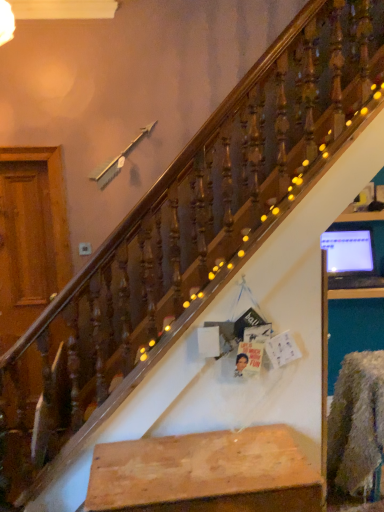
Question: Is wooden plank at center looking in the opposite direction of matte black monitor at upper right?

Choices:
 (A) no
 (B) yes

Answer: (A)

Question: Does wooden plank at center turn towards matte black monitor at upper right?

Choices:
 (A) yes
 (B) no

Answer: (B)

Question: Does wooden plank at center contain matte black monitor at upper right?

Choices:
 (A) yes
 (B) no

Answer: (B)

Question: Considering the relative sizes of wooden plank at center and matte black monitor at upper right in the image provided, is wooden plank at center smaller than matte black monitor at upper right?

Choices:
 (A) no
 (B) yes

Answer: (A)

Question: Is wooden plank at center taller than matte black monitor at upper right?

Choices:
 (A) yes
 (B) no

Answer: (A)

Question: From a real-world perspective, is wooden plank at center physically below matte black monitor at upper right?

Choices:
 (A) yes
 (B) no

Answer: (A)

Question: Is the depth of matte black monitor at upper right greater than that of wooden plank at center?

Choices:
 (A) yes
 (B) no

Answer: (A)

Question: Is the surface of matte black monitor at upper right in direct contact with wooden plank at center?

Choices:
 (A) no
 (B) yes

Answer: (A)

Question: Is matte black monitor at upper right at the left side of wooden plank at center?

Choices:
 (A) no
 (B) yes

Answer: (A)

Question: Can you confirm if matte black monitor at upper right is bigger than wooden plank at center?

Choices:
 (A) yes
 (B) no

Answer: (B)

Question: From the image's perspective, is matte black monitor at upper right below wooden plank at center?

Choices:
 (A) yes
 (B) no

Answer: (B)

Question: Is matte black monitor at upper right looking in the opposite direction of wooden plank at center?

Choices:
 (A) yes
 (B) no

Answer: (B)

Question: Considering the positions of wooden plank at center and matte black monitor at upper right in the image, is wooden plank at center taller or shorter than matte black monitor at upper right?

Choices:
 (A) short
 (B) tall

Answer: (B)